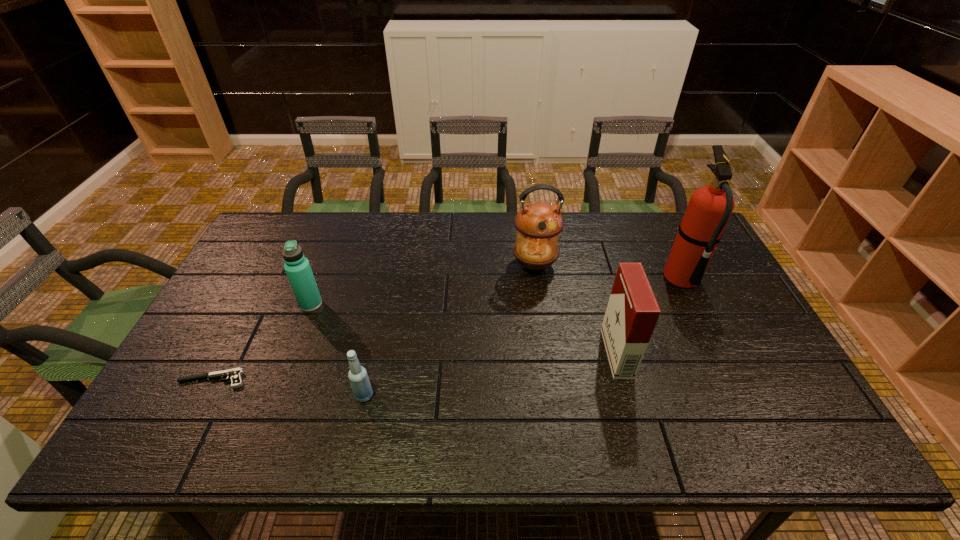
Image resolution: width=960 pixels, height=540 pixels. I want to click on the rightmost object, so click(x=709, y=208).

In order to click on the tallest object in this screenshot , I will do `click(709, 208)`.

I want to click on oil lamp, so click(x=538, y=224).

Find the location of a particular element. the third object from right to left is located at coordinates (538, 224).

Find the location of `the fifth object from left to right`. the fifth object from left to right is located at coordinates (632, 312).

Image resolution: width=960 pixels, height=540 pixels. In order to click on thermos bottle in this screenshot , I will do `click(297, 267)`.

Locate an element on the screen. The height and width of the screenshot is (540, 960). the fifth tallest object is located at coordinates (359, 381).

Find the location of a particular element. The height and width of the screenshot is (540, 960). the fourth object from right to left is located at coordinates (359, 381).

The image size is (960, 540). Find the location of `pistol`. pistol is located at coordinates (235, 374).

This screenshot has width=960, height=540. I want to click on the leftmost object, so [235, 374].